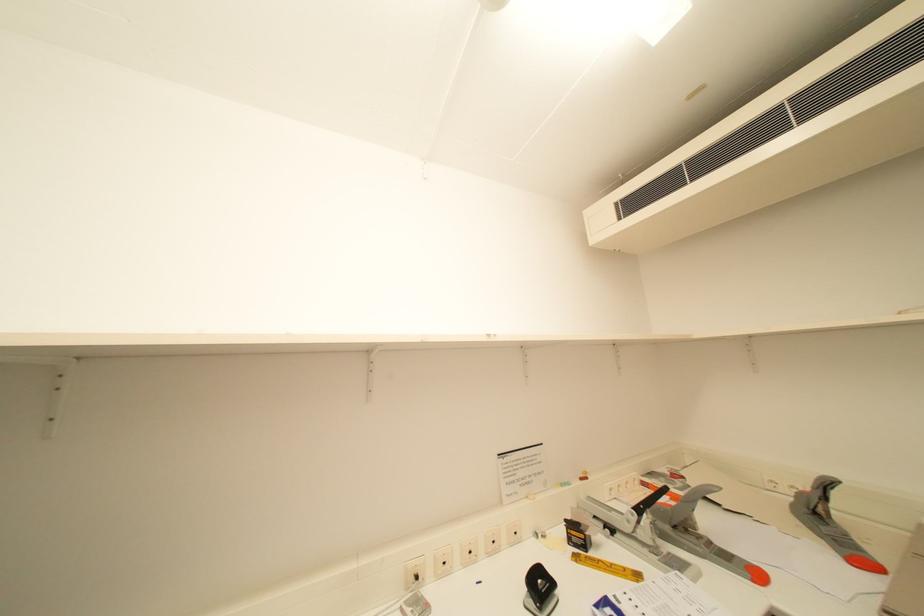
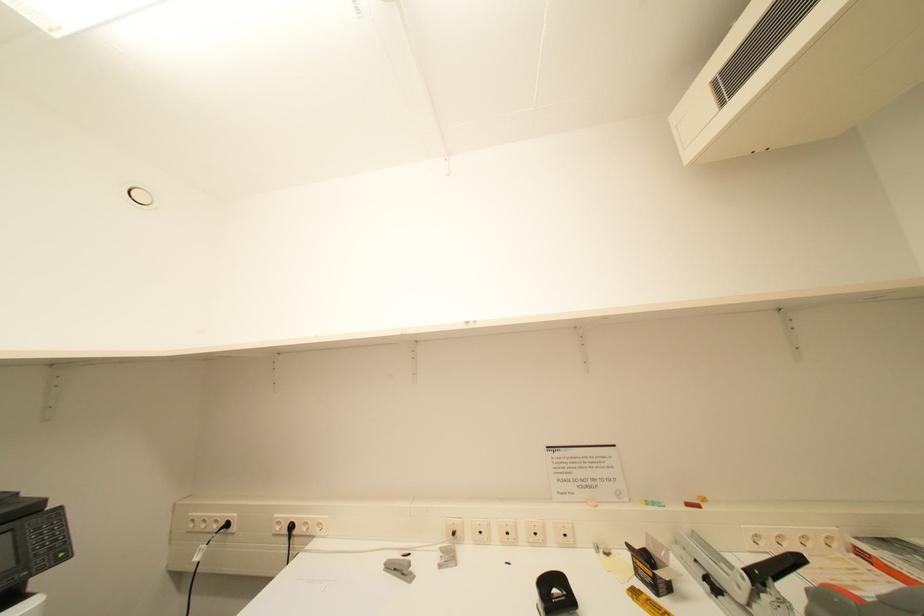
Question: The camera is either moving clockwise (left) or counter-clockwise (right) around the object. The first image is from the beginning of the video and the second image is from the end. Is the camera moving left or right when shooting the video?

Choices:
 (A) Left
 (B) Right

Answer: (B)